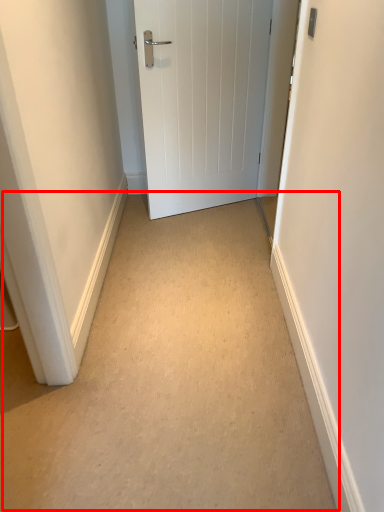
Question: From the image's perspective, what is the correct spatial relationship of path (annotated by the red box) in relation to door?

Choices:
 (A) above
 (B) below

Answer: (B)